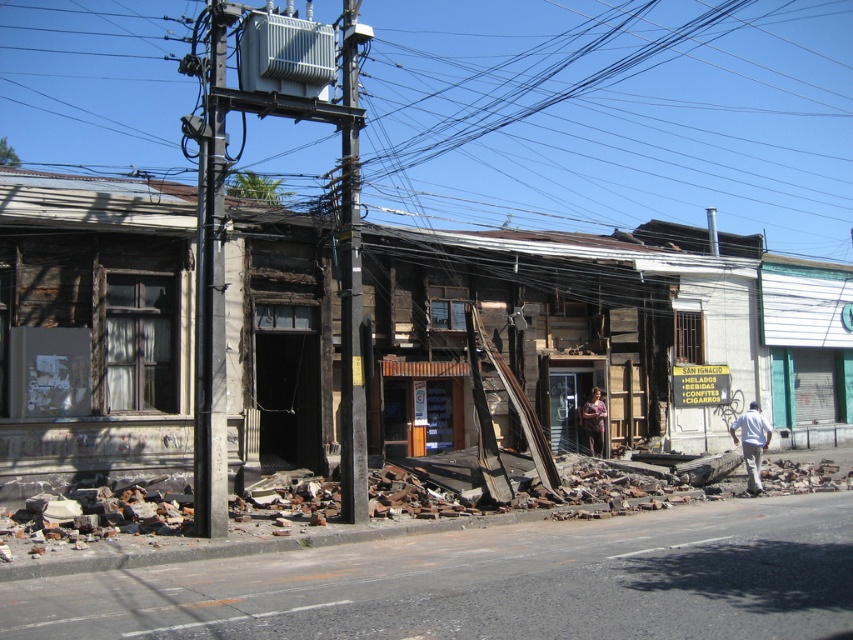
Between metallic gray utility pole at left and black metal/wooden pole at center, which one has less height?

With less height is metallic gray utility pole at left.

Between metallic gray utility pole at left and black metal/wooden pole at center, which one is positioned higher?

black metal/wooden pole at center is above.

Identify the location of metallic gray utility pole at left. Image resolution: width=853 pixels, height=640 pixels. [x=210, y=284].

Does point (339, 225) come closer to viewer compared to point (757, 444)?

Yes, point (339, 225) is in front of point (757, 444).

Between point (360, 259) and point (741, 426), which one is positioned in front?

Point (360, 259) is in front.

The image size is (853, 640). What do you see at coordinates (351, 285) in the screenshot?
I see `black metal/wooden pole at center` at bounding box center [351, 285].

Identify the location of black metal/wooden pole at center. Image resolution: width=853 pixels, height=640 pixels. (351, 285).

Which is in front, point (213, 516) or point (755, 461)?

Point (213, 516) is more forward.

Does metallic gray utility pole at left appear on the right side of white matte shirt at lower right?

In fact, metallic gray utility pole at left is to the left of white matte shirt at lower right.

The image size is (853, 640). Identify the location of metallic gray utility pole at left. (210, 284).

Identify the location of metallic gray utility pole at left. [x=210, y=284].